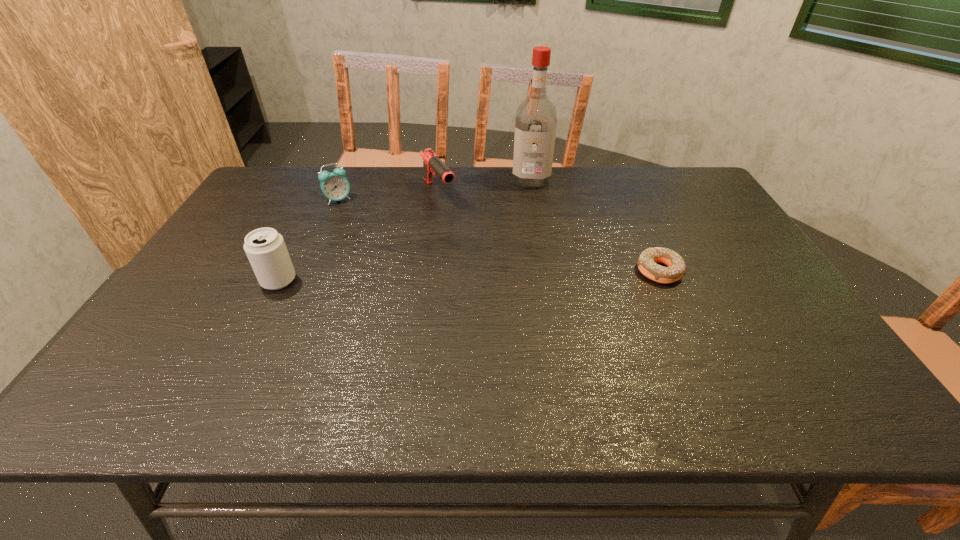
Image resolution: width=960 pixels, height=540 pixels. In order to click on alarm clock at the far edge in this screenshot , I will do `click(334, 185)`.

You are a GUI agent. You are given a task and a screenshot of the screen. Output one action in this format:
    pyautogui.click(x=<x>, y=<y>)
    Task: Click on the free space at the far edge
    The width and height of the screenshot is (960, 540).
    Given the screenshot: What is the action you would take?
    pyautogui.click(x=385, y=173)

Locate an element on the screen. The width and height of the screenshot is (960, 540). vacant region at the near edge of the desktop is located at coordinates (712, 341).

In the image, there is a desktop. At what (x,y) coordinates should I click in order to perform the action: click on vacant space at the left edge. Please return your answer as a coordinate pair (x, y). The image size is (960, 540). Looking at the image, I should click on (275, 225).

You are a GUI agent. You are given a task and a screenshot of the screen. Output one action in this format:
    pyautogui.click(x=<x>, y=<y>)
    Task: Click on the free region at the right edge
    
    Given the screenshot: What is the action you would take?
    pyautogui.click(x=753, y=262)

Image resolution: width=960 pixels, height=540 pixels. I want to click on free location at the near left corner, so click(163, 357).

Where is `free space at the near right corner of the desktop`? The width and height of the screenshot is (960, 540). free space at the near right corner of the desktop is located at coordinates (792, 348).

The image size is (960, 540). What are the coordinates of `vacant area that lies between the gun and the alarm clock` in the screenshot? It's located at (389, 196).

Where is `vacant space that is in between the alarm clock and the liquor`? The image size is (960, 540). vacant space that is in between the alarm clock and the liquor is located at coordinates (435, 190).

Locate an element on the screen. free space between the alarm clock and the gun is located at coordinates click(389, 196).